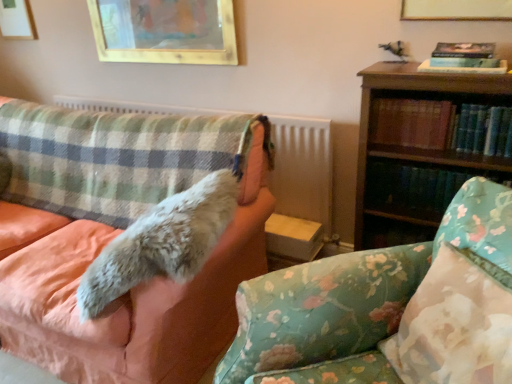
Question: From the image's perspective, relative to plaid fabric radiator at left, is fluffy fabric couch at center, which ranks as the first studio couch in left-to-right order, above or below?

Choices:
 (A) above
 (B) below

Answer: (B)

Question: From a real-world perspective, is fluffy fabric couch at center, the 2th studio couch viewed from the right, positioned above or below plaid fabric radiator at left?

Choices:
 (A) above
 (B) below

Answer: (B)

Question: Which is nearer to the hardcover book at right, the second book when ordered from top to bottom?

Choices:
 (A) fluffy white fur at left
 (B) plaid fabric radiator at left
 (C) gold-framed picture at upper center, which appears as the 1th picture frame when viewed from the right
 (D) floral fabric pillow at lower right
 (E) wooden bookshelf at right

Answer: (E)

Question: Which object is positioned closest to the gold-framed picture at upper center, the 2th picture frame when ordered from back to front?

Choices:
 (A) floral fabric pillow at lower right
 (B) gold-framed picture at upper center, arranged as the first picture frame when viewed from the front
 (C) fluffy white fur at left
 (D) wooden picture frame at upper left, which ranks as the 1th picture frame in left-to-right order
 (E) hardcover book at right, the 3th book in the top-to-bottom sequence

Answer: (D)